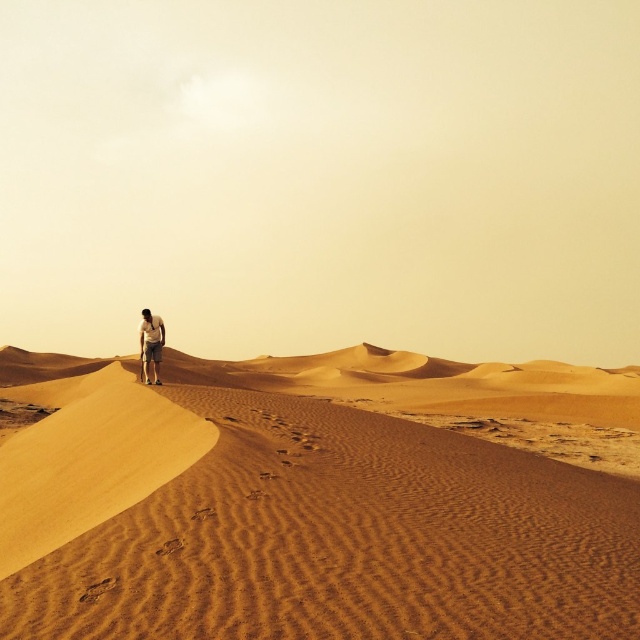
Question: Does sandy textured dunes at center have a lesser width compared to light brown sand at center?

Choices:
 (A) no
 (B) yes

Answer: (A)

Question: Is sandy textured dunes at center above light brown sand at center?

Choices:
 (A) no
 (B) yes

Answer: (A)

Question: Can you confirm if sandy textured dunes at center is positioned to the left of light brown sand at center?

Choices:
 (A) yes
 (B) no

Answer: (B)

Question: Which object is farther from the camera taking this photo?

Choices:
 (A) light brown sand at center
 (B) sandy textured dunes at center

Answer: (A)